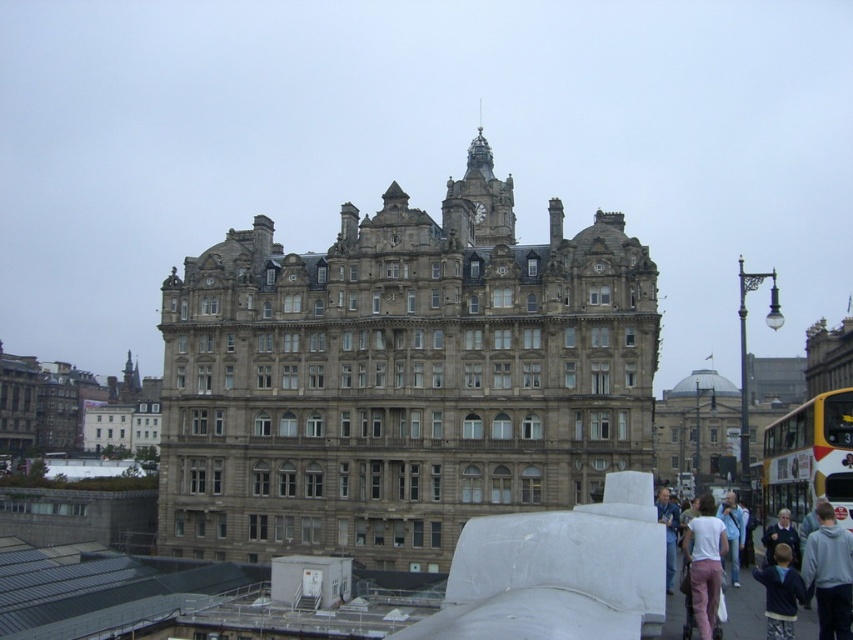
Which is more to the right, yellowmaterial bus at right or dark blue hoodie at lower right?

Positioned to the right is yellowmaterial bus at right.

Can you confirm if yellowmaterial bus at right is thinner than dark blue hoodie at lower right?

→ Yes.

Find the location of a particular element. This screenshot has height=640, width=853. yellowmaterial bus at right is located at coordinates (809, 458).

Can you confirm if white cotton shirt at lower right is wider than dark blue jacket at lower right?

No, white cotton shirt at lower right is not wider than dark blue jacket at lower right.

Who is more distant from viewer, (668, 566) or (798, 556)?

The point (668, 566) is more distant.

Does point (663, 492) come closer to viewer compared to point (779, 515)?

Yes, point (663, 492) is closer to viewer.

Identify the location of white cotton shirt at lower right. The height and width of the screenshot is (640, 853). (668, 532).

This screenshot has height=640, width=853. What do you see at coordinates (828, 573) in the screenshot? I see `gray hoodie at lower right` at bounding box center [828, 573].

Does gray hoodie at lower right have a larger size compared to dark blue hoodie at lower right?

Actually, gray hoodie at lower right might be smaller than dark blue hoodie at lower right.

Which is behind, point (827, 557) or point (782, 611)?

Point (827, 557)

The image size is (853, 640). I want to click on gray hoodie at lower right, so click(828, 573).